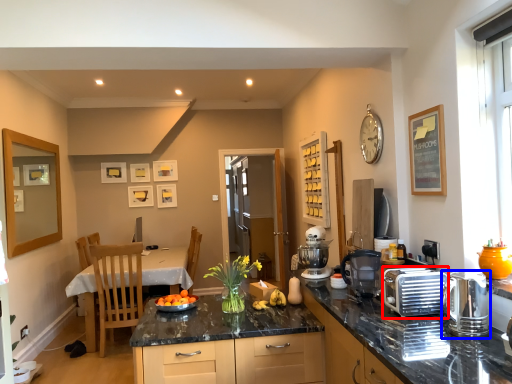
Question: Which object is closer to the camera taking this photo, appliance (highlighted by a red box) or kitchen appliance (highlighted by a blue box)?

Choices:
 (A) appliance
 (B) kitchen appliance

Answer: (B)